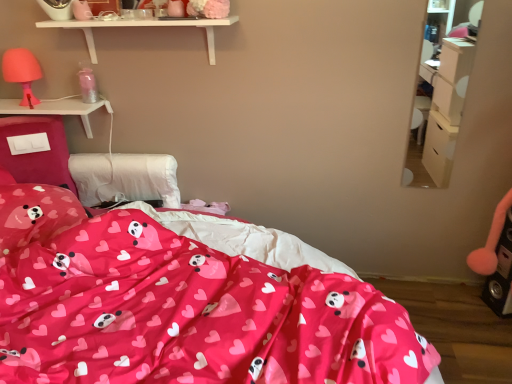
You are a GUI agent. You are given a task and a screenshot of the screen. Output one action in this format:
    pyautogui.click(x=<x>, y=<y>)
    Task: Click on the empty space that is to the right of matte pink lampshade at left
    This screenshot has height=384, width=512.
    Given the screenshot: What is the action you would take?
    pyautogui.click(x=59, y=105)